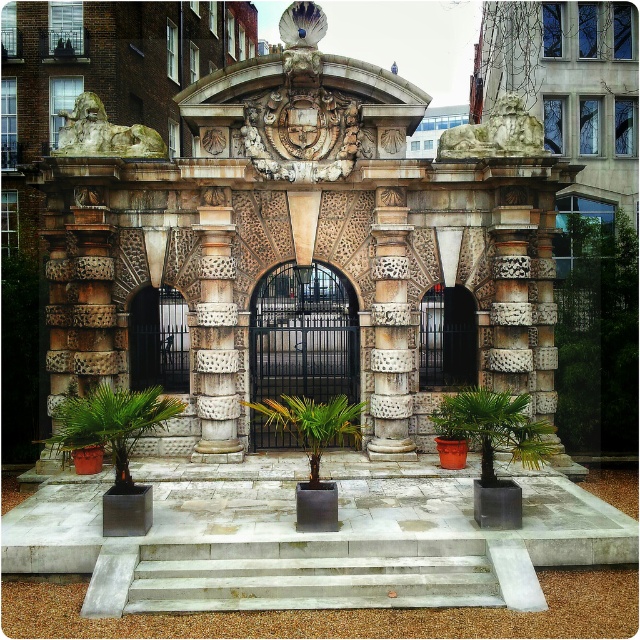
You are standing in front of the grand archway and want to enter through the entrance. Which object, the black metal gate at center or the carved stone column at center, is positioned to the right side from your perspective?

The black metal gate at center is positioned to the right of the carved stone column at center, so the black metal gate at center is on the right side.

You are standing in front of the grand stone archway and need to walk through the central gate. Which object, the concrete steps at center or the carved stone column at center, would you encounter first as you approach the archway?

You would first encounter the concrete steps at center before reaching the carved stone column at center since the steps are positioned under the column, meaning they are closer to the entrance.